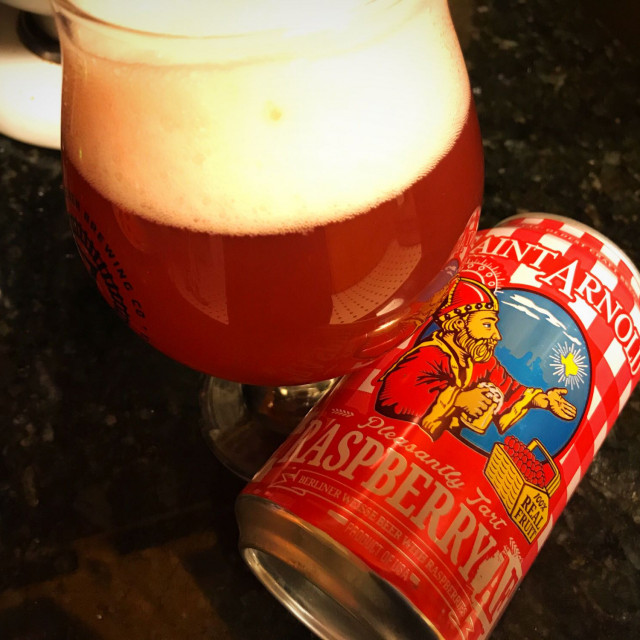
The image size is (640, 640). Find the location of `beer glass base`. beer glass base is located at coordinates (243, 432).